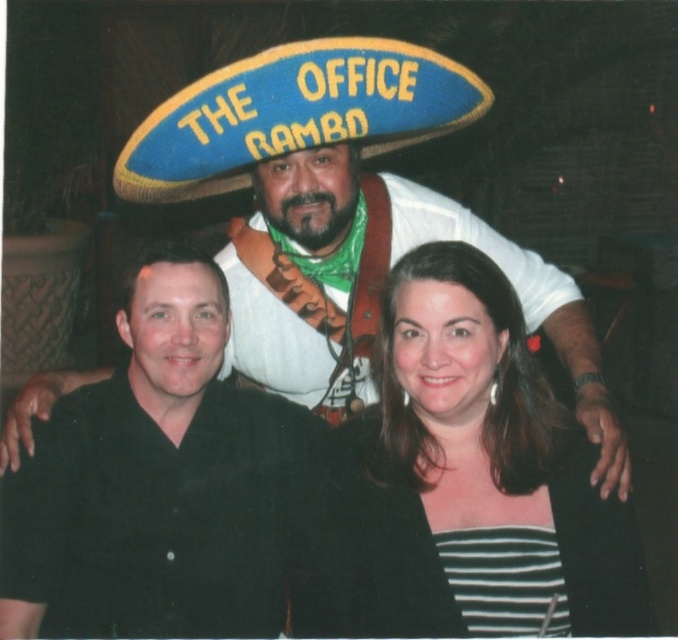
Question: Does white matte sombrero at upper center have a lesser width compared to black matte shirt at left?

Choices:
 (A) no
 (B) yes

Answer: (A)

Question: Which is farther from the blue felt sombrero at upper center?

Choices:
 (A) matte black blazer at center
 (B) white matte sombrero at upper center
 (C) black matte shirt at left

Answer: (A)

Question: Does matte black blazer at center appear under black matte shirt at left?

Choices:
 (A) no
 (B) yes

Answer: (B)

Question: Is matte black blazer at center to the left of black matte shirt at left from the viewer's perspective?

Choices:
 (A) yes
 (B) no

Answer: (B)

Question: Which of these objects is positioned farthest from the white matte sombrero at upper center?

Choices:
 (A) matte black blazer at center
 (B) black matte shirt at left
 (C) blue felt sombrero at upper center

Answer: (B)

Question: Considering the real-world distances, which object is closest to the white matte sombrero at upper center?

Choices:
 (A) matte black blazer at center
 (B) black matte shirt at left

Answer: (A)